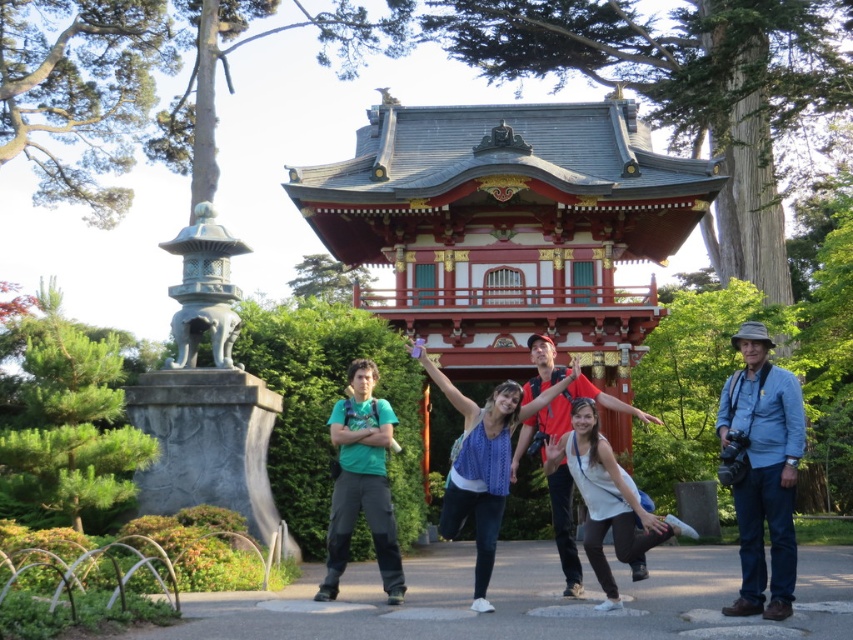
Question: Is green matte t-shirt at center positioned behind white cotton dress at center?

Choices:
 (A) no
 (B) yes

Answer: (B)

Question: In this image, where is blue denim jeans at right located relative to green matte t-shirt at center?

Choices:
 (A) below
 (B) above

Answer: (A)

Question: Is green matte t-shirt at center further to camera compared to white cotton dress at center?

Choices:
 (A) no
 (B) yes

Answer: (B)

Question: Which point is farther to the camera?

Choices:
 (A) white cotton dress at center
 (B) blue denim jeans at right

Answer: (A)

Question: Among these points, which one is nearest to the camera?

Choices:
 (A) (780, 582)
 (B) (619, 486)

Answer: (A)

Question: Which point appears farthest from the camera in this image?

Choices:
 (A) (796, 481)
 (B) (376, 497)

Answer: (B)